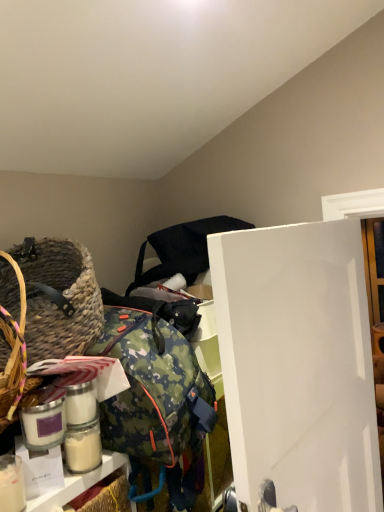
Locate an element on the screen. This screenshot has height=512, width=384. empty space that is ontop of white glossy door at center right (from a real-world perspective) is located at coordinates (298, 224).